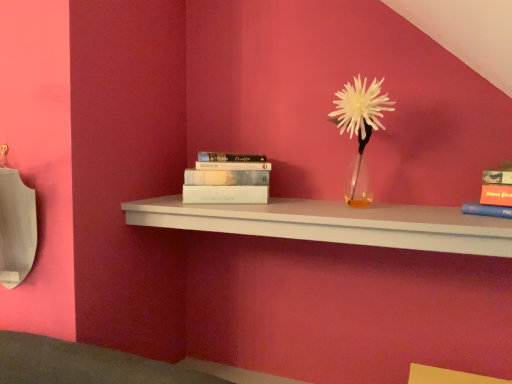
Question: Is white matte book at center, which ranks as the 2th book in right-to-left order, smaller than white matte shelf at center?

Choices:
 (A) no
 (B) yes

Answer: (B)

Question: Is white matte book at center, which ranks as the 1th book in back-to-front order, turned away from white matte shelf at center?

Choices:
 (A) no
 (B) yes

Answer: (A)

Question: Can you confirm if white matte book at center, which is the 1th book from left to right, is bigger than white matte shelf at center?

Choices:
 (A) no
 (B) yes

Answer: (A)

Question: Could you tell me if white matte book at center, which is the 1th book from left to right, is turned towards white matte shelf at center?

Choices:
 (A) no
 (B) yes

Answer: (A)

Question: Is white matte book at center, which ranks as the 2th book in right-to-left order, closer to the viewer compared to white matte shelf at center?

Choices:
 (A) no
 (B) yes

Answer: (A)

Question: Considering the positions of white matte shelf at center and white matte flower at center in the image, is white matte shelf at center taller or shorter than white matte flower at center?

Choices:
 (A) tall
 (B) short

Answer: (B)

Question: From the image's perspective, is white matte shelf at center located above or below white matte flower at center?

Choices:
 (A) above
 (B) below

Answer: (B)

Question: In terms of width, does white matte shelf at center look wider or thinner when compared to white matte flower at center?

Choices:
 (A) thin
 (B) wide

Answer: (B)

Question: Is white matte shelf at center situated inside white matte flower at center or outside?

Choices:
 (A) outside
 (B) inside

Answer: (A)

Question: From a real-world perspective, is matte orange book at upper right, the first book from the front, above or below white matte book at center, which is the 1th book from left to right?

Choices:
 (A) below
 (B) above

Answer: (A)

Question: From the image's perspective, is matte orange book at upper right, the second book positioned from the left, positioned above or below white matte book at center, which is the 1th book from left to right?

Choices:
 (A) above
 (B) below

Answer: (B)

Question: Considering the positions of matte orange book at upper right, the second book positioned from the left, and white matte book at center, which ranks as the 1th book in back-to-front order, in the image, is matte orange book at upper right, the second book positioned from the left, taller or shorter than white matte book at center, which ranks as the 1th book in back-to-front order,?

Choices:
 (A) short
 (B) tall

Answer: (A)

Question: Would you say matte orange book at upper right, marked as the second book in a back-to-front arrangement, is to the left or to the right of white matte book at center, which ranks as the 2th book in right-to-left order, in the picture?

Choices:
 (A) right
 (B) left

Answer: (A)

Question: Does point (374, 91) appear closer or farther from the camera than point (225, 225)?

Choices:
 (A) farther
 (B) closer

Answer: (B)

Question: From the image's perspective, is white matte flower at center above or below white matte shelf at center?

Choices:
 (A) above
 (B) below

Answer: (A)